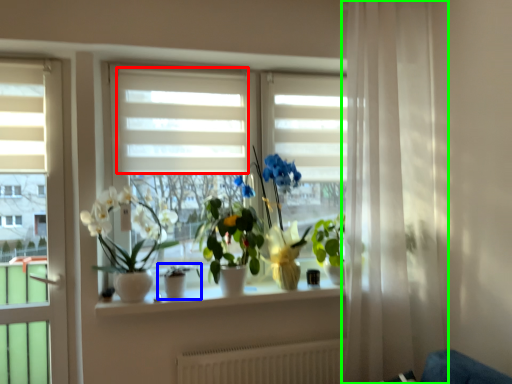
Question: Estimate the real-world distances between objects in this image. Which object is farther from blind (highlighted by a red box), houseplant (highlighted by a blue box) or curtain (highlighted by a green box)?

Choices:
 (A) houseplant
 (B) curtain

Answer: (B)